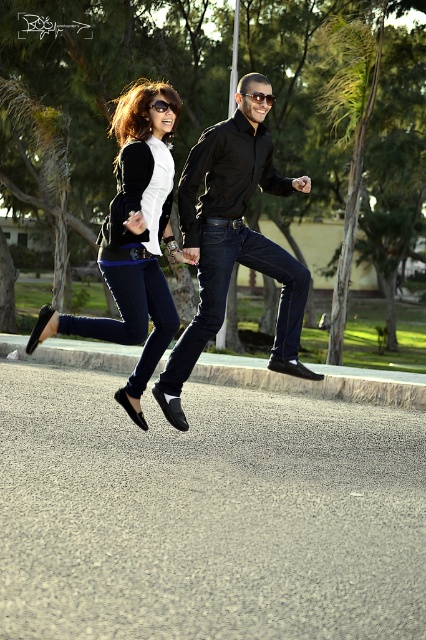
Is denim jeans at center to the left of black plastic sunglasses at upper center from the viewer's perspective?

Yes, denim jeans at center is to the left of black plastic sunglasses at upper center.

Looking at this image, can you confirm if denim jeans at center is wider than black plastic sunglasses at upper center?

Yes, denim jeans at center is wider than black plastic sunglasses at upper center.

Describe the element at coordinates (132, 316) in the screenshot. I see `denim jeans at center` at that location.

Locate an element on the screen. denim jeans at center is located at coordinates (132, 316).

Is matte black shoes at lower left to the right of dark blue denim jeans at center from the viewer's perspective?

In fact, matte black shoes at lower left is to the left of dark blue denim jeans at center.

Between point (127, 100) and point (239, 253), which one is positioned in front?

Point (127, 100) is in front.

Which is in front, point (129, 257) or point (273, 356)?

Point (129, 257)

Locate an element on the screen. matte black shoes at lower left is located at coordinates (132, 243).

Is point (160, 134) closer to viewer compared to point (141, 266)?

No.

Is matte black shoes at lower left smaller than denim jeans at center?

No.

Is point (147, 269) positioned in front of point (126, 300)?

That is False.

Identify the location of matte black shoes at lower left. Image resolution: width=426 pixels, height=640 pixels. (132, 243).